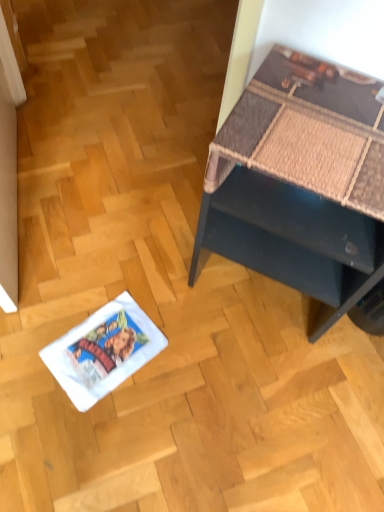
Question: From a real-world perspective, does dark blue textured desk at upper right sit lower than white paper comic book at lower left?

Choices:
 (A) no
 (B) yes

Answer: (A)

Question: From the image's perspective, does dark blue textured desk at upper right appear lower than white paper comic book at lower left?

Choices:
 (A) yes
 (B) no

Answer: (B)

Question: Considering the relative sizes of dark blue textured desk at upper right and white paper comic book at lower left in the image provided, is dark blue textured desk at upper right shorter than white paper comic book at lower left?

Choices:
 (A) yes
 (B) no

Answer: (B)

Question: Does dark blue textured desk at upper right come in front of white paper comic book at lower left?

Choices:
 (A) no
 (B) yes

Answer: (B)

Question: Is white paper comic book at lower left at the back of dark blue textured desk at upper right?

Choices:
 (A) yes
 (B) no

Answer: (B)

Question: Could you tell me if dark blue textured desk at upper right is turned towards white paper comic book at lower left?

Choices:
 (A) yes
 (B) no

Answer: (A)

Question: Is white paper comic book at lower left facing away from dark blue textured desk at upper right?

Choices:
 (A) yes
 (B) no

Answer: (B)

Question: Is white paper comic book at lower left oriented towards dark blue textured desk at upper right?

Choices:
 (A) no
 (B) yes

Answer: (A)

Question: Considering the relative sizes of white paper comic book at lower left and dark blue textured desk at upper right in the image provided, is white paper comic book at lower left taller than dark blue textured desk at upper right?

Choices:
 (A) yes
 (B) no

Answer: (B)

Question: Considering the relative sizes of white paper comic book at lower left and dark blue textured desk at upper right in the image provided, is white paper comic book at lower left wider than dark blue textured desk at upper right?

Choices:
 (A) yes
 (B) no

Answer: (B)

Question: Can you confirm if white paper comic book at lower left is positioned to the right of dark blue textured desk at upper right?

Choices:
 (A) no
 (B) yes

Answer: (A)

Question: Is white paper comic book at lower left further to the viewer compared to dark blue textured desk at upper right?

Choices:
 (A) yes
 (B) no

Answer: (A)

Question: From a real-world perspective, is white paper comic book at lower left physically located above or below dark blue textured desk at upper right?

Choices:
 (A) below
 (B) above

Answer: (A)